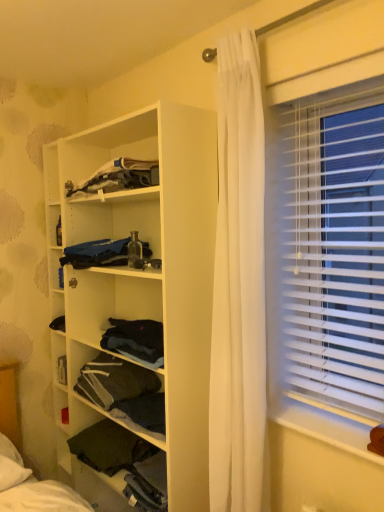
Question: Is white plastic blinds at right inside or outside of blue fabric at center, marked as the 1th clothing in a bottom-to-top arrangement?

Choices:
 (A) outside
 (B) inside

Answer: (A)

Question: From the image's perspective, relative to blue fabric at center, the 2th clothing in the top-to-bottom sequence, is white plastic blinds at right above or below?

Choices:
 (A) below
 (B) above

Answer: (A)

Question: Estimate the real-world distances between objects in this image. Which object is closer to the white plastic blinds at right?

Choices:
 (A) blue fabric at center, marked as the 1th clothing in a bottom-to-top arrangement
 (B) white matte wooden shelf at center, which appears as the 3th shelf when ordered from the bottom
 (C) white plastic window sill at lower right
 (D) dark gray fabric at upper center, the 1th clothing when ordered from top to bottom
 (E) dark fabric at lower left, which ranks as the 3th shelf in top-to-bottom order

Answer: (C)

Question: Based on their relative distances, which object is nearer to the dark fabric at center, placed as the second shelf when sorted from bottom to top?

Choices:
 (A) blue fabric at center, the 2th clothing in the top-to-bottom sequence
 (B) white plastic window sill at lower right
 (C) white matte wooden shelf at center, which is the 1th shelf from top to bottom
 (D) dark fabric at lower left, which ranks as the 3th shelf in top-to-bottom order
 (E) dark gray fabric at upper center, the second clothing from the bottom

Answer: (D)